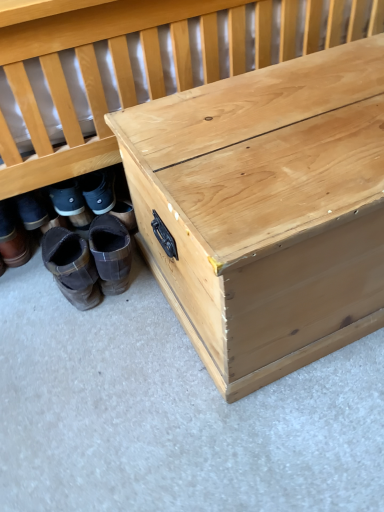
Identify the location of empty space that is ontop of natural wood trunk at center (from a real-world perspective). (294, 114).